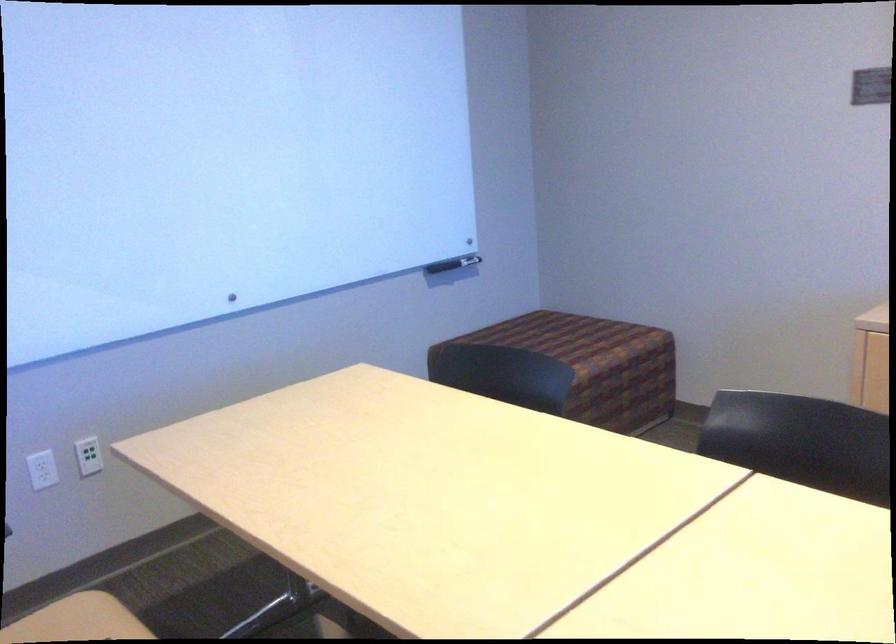
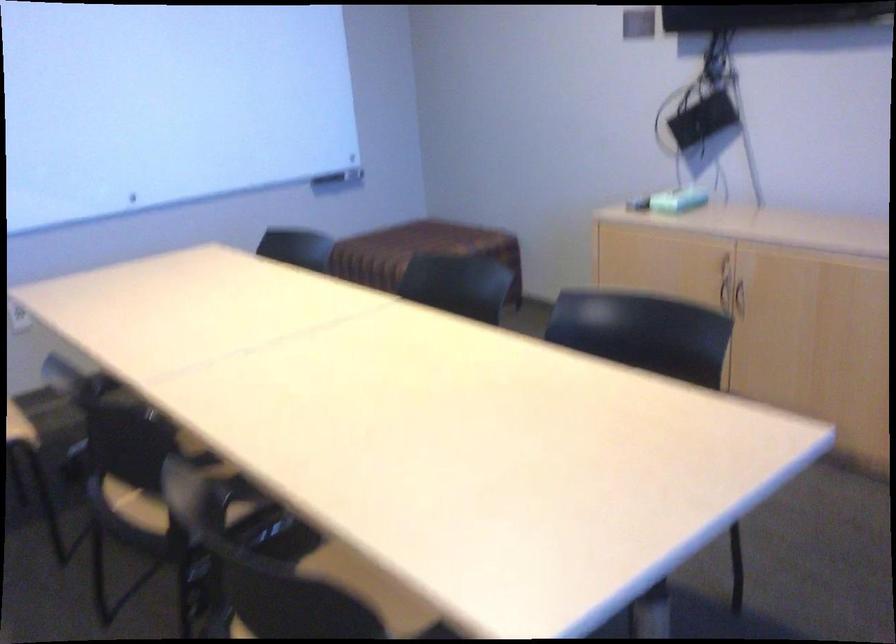
Question: The first image is from the beginning of the video and the second image is from the end. How did the camera likely rotate when shooting the video?

Choices:
 (A) Left
 (B) Right
 (C) Up
 (D) Down

Answer: (D)